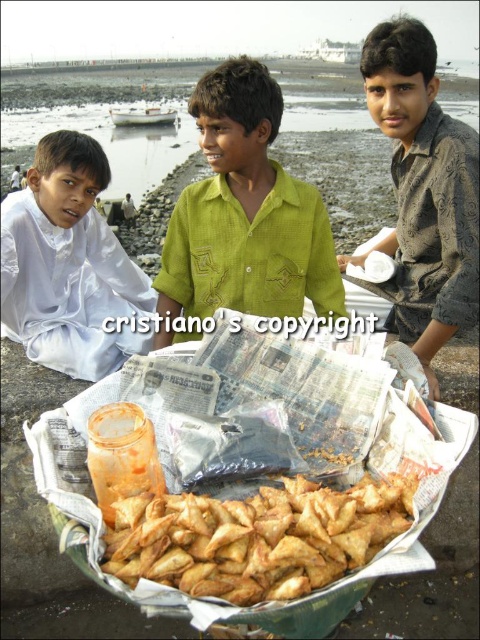
Is point (279, 118) less distant than point (435, 54)?

No.

Does green textured shirt at center appear on the left side of patterned brown shirt at right?

Yes, green textured shirt at center is to the left of patterned brown shirt at right.

Between point (274, 268) and point (420, 330), which one is positioned behind?

Point (420, 330)

At what (x,y) coordinates should I click in order to perform the action: click on green textured shirt at center. Please return your answer as a coordinate pair (x, y). Looking at the image, I should click on (245, 212).

What do you see at coordinates (424, 192) in the screenshot?
I see `patterned brown shirt at right` at bounding box center [424, 192].

Measure the distance between point (408, 26) and camera.

They are 7.67 feet apart.

Does point (360, 68) come farther from viewer compared to point (32, 356)?

Yes, it is behind point (32, 356).

Find the location of a particular element. Image resolution: width=480 pixels, height=640 pixels. patterned brown shirt at right is located at coordinates (424, 192).

Can you confirm if green textured shirt at center is smaller than golden crispy samosa at center?

Actually, green textured shirt at center might be larger than golden crispy samosa at center.

At what (x,y) coordinates should I click in order to perform the action: click on green textured shirt at center. Please return your answer as a coordinate pair (x, y). Looking at the image, I should click on (245, 212).